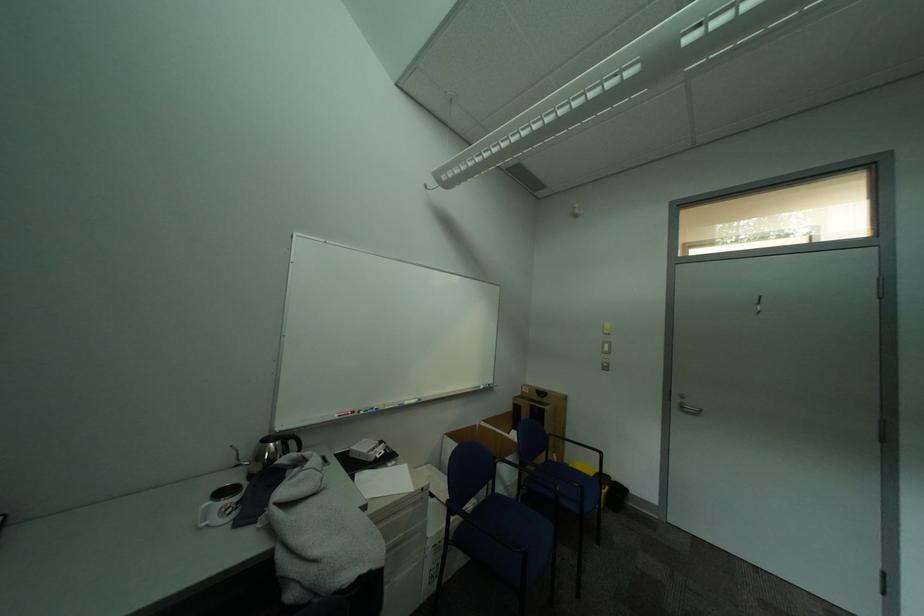
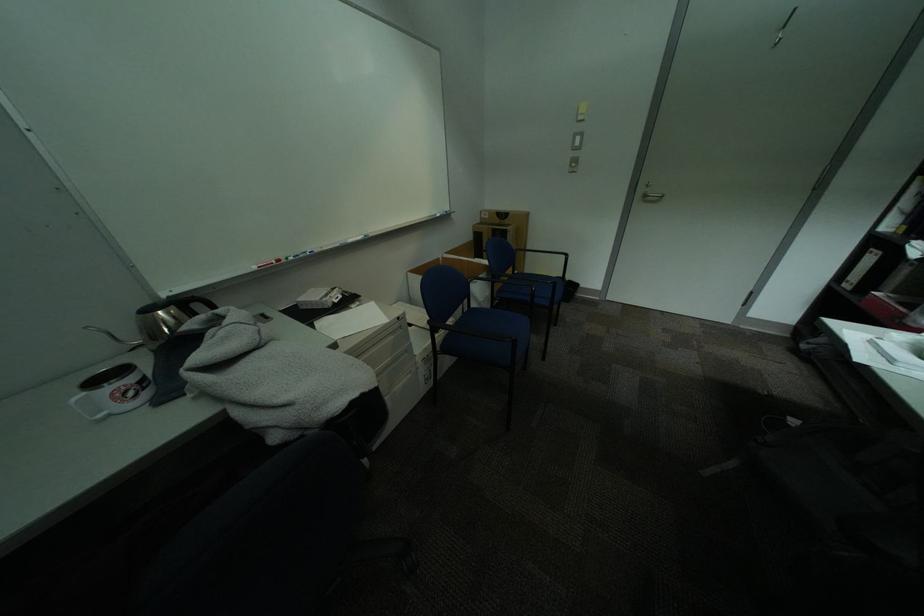
Where in the second image is the point corresponding to point (215, 508) from the first image?

(90, 400)